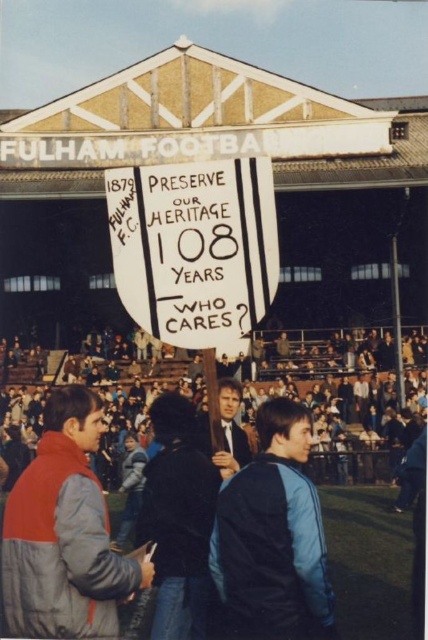
At what (x,y) coordinates should I click in order to perform the action: click on white paper sign at center. Please return your answer as a coordinate pair (x, y). This screenshot has height=640, width=428. Looking at the image, I should click on (195, 248).

Who is shorter, white paper sign at center or gray down jacket at lower left?

Standing shorter between the two is white paper sign at center.

Is point (124, 168) in front of point (8, 515)?

No, (124, 168) is further to viewer.

This screenshot has width=428, height=640. I want to click on white paper sign at center, so click(195, 248).

Can you confirm if dark gray clothing at lower center is wider than blue fabric jacket at center?

Indeed, dark gray clothing at lower center has a greater width compared to blue fabric jacket at center.

Looking at this image, is dark gray clothing at lower center to the left of blue fabric jacket at center from the viewer's perspective?

Indeed, dark gray clothing at lower center is positioned on the left side of blue fabric jacket at center.

Does point (398, 451) come closer to viewer compared to point (253, 513)?

No, (398, 451) is behind (253, 513).

Where is `dark gray clothing at lower center`? The width and height of the screenshot is (428, 640). dark gray clothing at lower center is located at coordinates (347, 397).

Is blue fabric jacket at center positioned behind dark blue jacket at center?

No.

Does blue fabric jacket at center appear on the right side of dark blue jacket at center?

Correct, you'll find blue fabric jacket at center to the right of dark blue jacket at center.

At what (x,y) coordinates should I click in order to perform the action: click on blue fabric jacket at center. Please return your answer as a coordinate pair (x, y). Image resolution: width=428 pixels, height=640 pixels. Looking at the image, I should click on (273, 534).

Find the location of `blue fabric jacket at center`. blue fabric jacket at center is located at coordinates (273, 534).